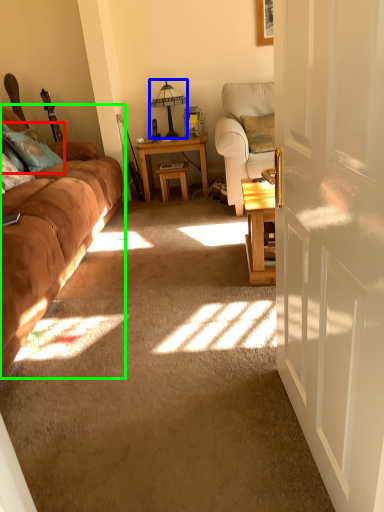
Question: Which object is the farthest from pillow (highlighted by a red box)? Choose among these: table lamp (highlighted by a blue box) or studio couch (highlighted by a green box).

Choices:
 (A) table lamp
 (B) studio couch

Answer: (A)